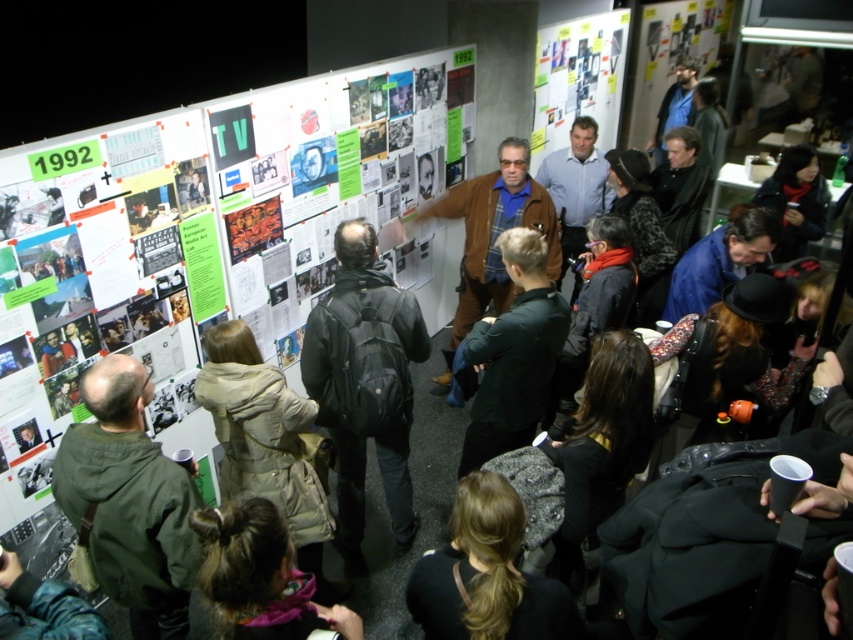
Between tan leather coat at center and dark brown hair at lower center, which one appears on the right side from the viewer's perspective?

Positioned to the right is dark brown hair at lower center.

Is tan leather coat at center bigger than dark brown hair at lower center?

Yes.

Is point (235, 388) positioned after point (244, 524)?

Yes, point (235, 388) is behind point (244, 524).

This screenshot has width=853, height=640. What are the coordinates of `tan leather coat at center` in the screenshot? It's located at (265, 442).

Does black matte backpack at center have a lesser width compared to dark brown hair at center?

No.

Who is more forward, (408,292) or (425,637)?

Positioned in front is point (425,637).

In order to click on black matte backpack at center in this screenshot , I will do `click(364, 385)`.

Based on the photo, which is more to the left, tan leather coat at center or brown leather jacket at center?

tan leather coat at center is more to the left.

Can you confirm if tan leather coat at center is thinner than brown leather jacket at center?

Indeed, tan leather coat at center has a lesser width compared to brown leather jacket at center.

Find the location of `tan leather coat at center`. tan leather coat at center is located at coordinates tap(265, 442).

Locate an element on the screen. The image size is (853, 640). tan leather coat at center is located at coordinates (265, 442).